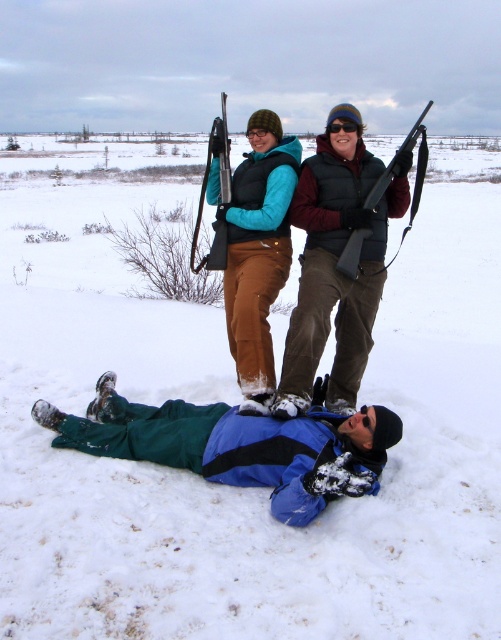
Question: Which point is closer to the camera?

Choices:
 (A) black plastic goggles at upper center
 (B) blue fleece jacket at lower center

Answer: (B)

Question: Estimate the real-world distances between objects in this image. Which object is closer to the blue fleece jacket at lower center?

Choices:
 (A) matte black vest at upper center
 (B) black plastic goggles at upper center

Answer: (A)

Question: Can you confirm if blue fleece jacket at lower center is positioned to the right of matte black vest at upper center?

Choices:
 (A) no
 (B) yes

Answer: (A)

Question: Does blue fleece jacket at lower center appear on the right side of black plastic goggles at upper center?

Choices:
 (A) yes
 (B) no

Answer: (B)

Question: Which point is farther to the camera?

Choices:
 (A) matte black vest at upper center
 (B) blue fleece jacket at lower center

Answer: (A)

Question: Can you confirm if blue fleece jacket at lower center is bigger than black plastic goggles at upper center?

Choices:
 (A) yes
 (B) no

Answer: (A)